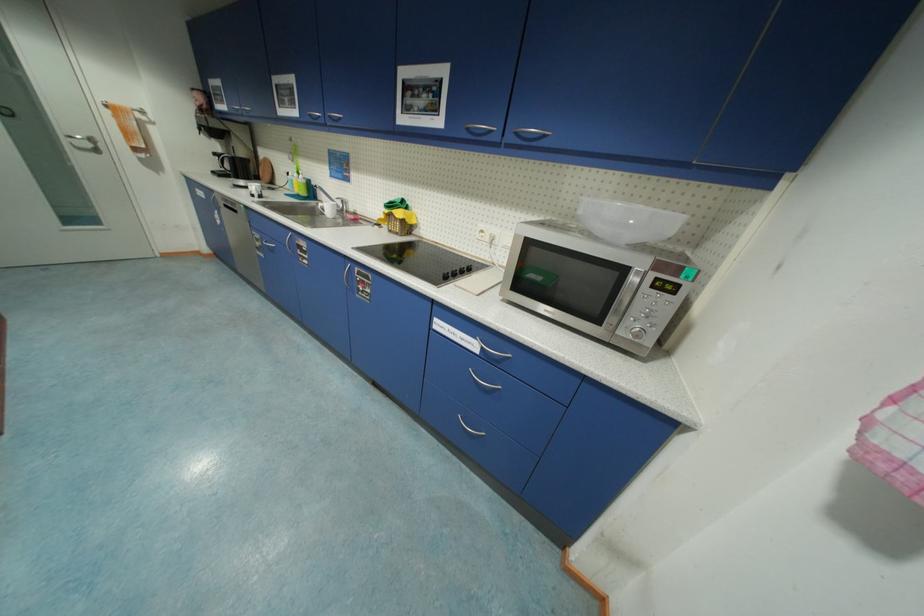
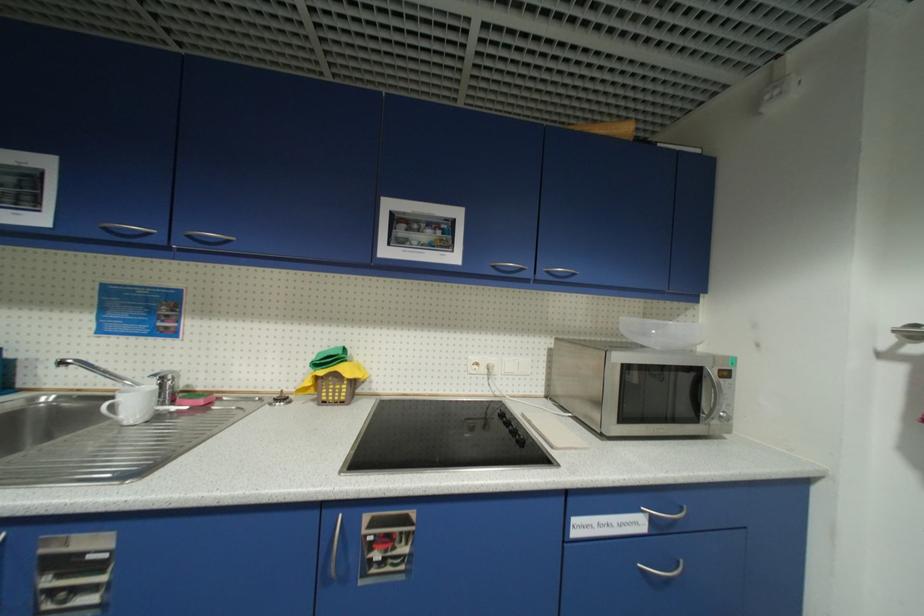
Question: The camera is either moving clockwise (left) or counter-clockwise (right) around the object. The first image is from the beginning of the video and the second image is from the end. Is the camera moving left or right when shooting the video?

Choices:
 (A) Left
 (B) Right

Answer: (A)